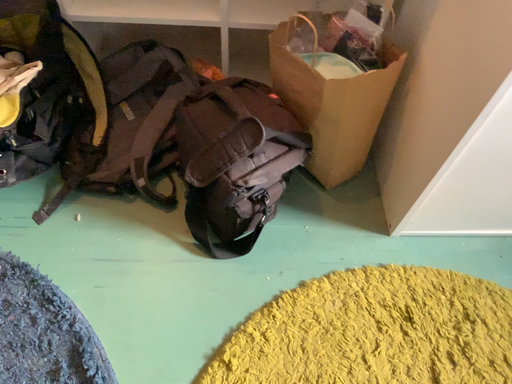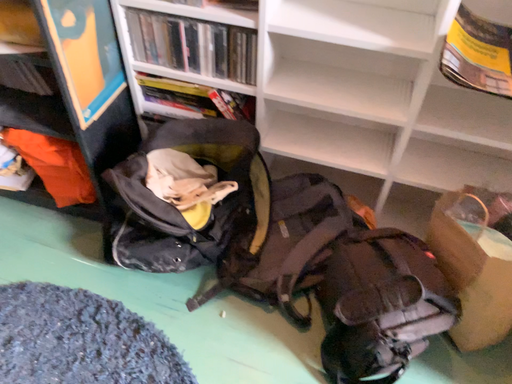
Question: How did the camera likely rotate when shooting the video?

Choices:
 (A) rotated upward
 (B) rotated downward

Answer: (A)